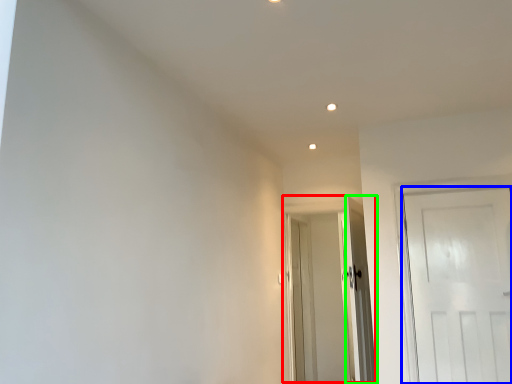
Question: Considering the real-world distances, which object is farthest from door (highlighted by a red box)? door (highlighted by a blue box) or door (highlighted by a green box)?

Choices:
 (A) door
 (B) door

Answer: (A)